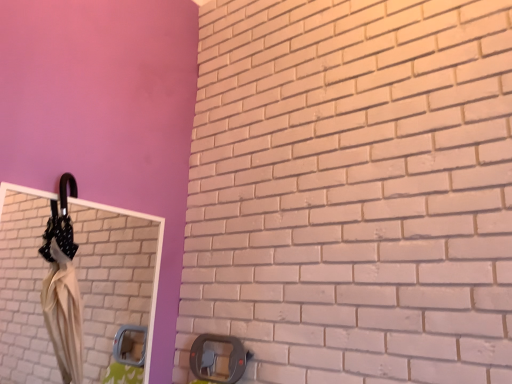
Identify the location of white glossy mirror at upper left. (113, 275).

Image resolution: width=512 pixels, height=384 pixels. Describe the element at coordinates (113, 275) in the screenshot. I see `white glossy mirror at upper left` at that location.

Locate an element on the screen. white glossy mirror at upper left is located at coordinates (113, 275).